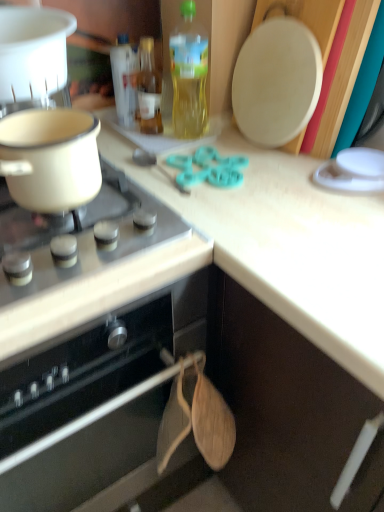
Question: Is white plastic pot at upper left, which is the second kitchen appliance from bottom to top, bigger or smaller than translucent glass bottle at upper center, the second bottle in the right-to-left sequence?

Choices:
 (A) small
 (B) big

Answer: (B)

Question: Is white plastic pot at upper left, which is the second kitchen appliance from bottom to top, wider or thinner than translucent glass bottle at upper center, the second bottle in the right-to-left sequence?

Choices:
 (A) wide
 (B) thin

Answer: (A)

Question: Which is farther from the translucent yellow bottle at upper center, the first bottle in the right-to-left sequence?

Choices:
 (A) translucent glass bottle at upper center, which ranks as the second bottle in left-to-right order
 (B) white glossy gas stove at upper left
 (C) white plastic pot at upper left, which is the second kitchen appliance from bottom to top
 (D) matte white pot at left, which is the 2th kitchen appliance in top-to-bottom order
 (E) black matte oven at lower left

Answer: (E)

Question: Based on their relative distances, which object is nearer to the white plastic pot at upper left, which is the second kitchen appliance from bottom to top?

Choices:
 (A) white glossy gas stove at upper left
 (B) matte white pot at left, acting as the 1th kitchen appliance starting from the bottom
 (C) translucent yellow bottle at upper center, the third bottle viewed from the left
 (D) black matte oven at lower left
 (E) translucent glass bottle at upper center, which ranks as the second bottle in left-to-right order

Answer: (B)